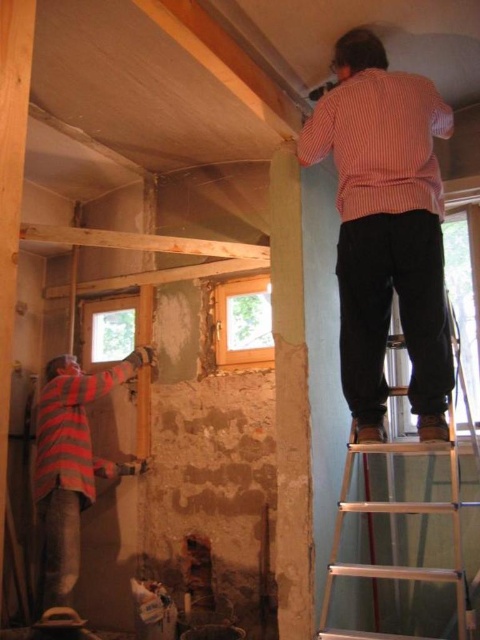
Which is in front, point (431, 177) or point (451, 304)?

Positioned in front is point (431, 177).

Does striped cotton shirt at upper right have a lesser width compared to silver metallic ladder at upper right?

Indeed, striped cotton shirt at upper right has a lesser width compared to silver metallic ladder at upper right.

Does point (361, 417) lie behind point (456, 384)?

Yes, point (361, 417) is behind point (456, 384).

The image size is (480, 640). I want to click on striped cotton shirt at upper right, so click(385, 228).

Does point (40, 536) come behind point (444, 504)?

Yes, point (40, 536) is behind point (444, 504).

Can you confirm if striped fabric construction worker at lower left is positioned to the right of silver metallic ladder at upper right?

Incorrect, striped fabric construction worker at lower left is not on the right side of silver metallic ladder at upper right.

Which is behind, point (73, 396) or point (348, 456)?

The point (73, 396) is behind.

Where is `striped fabric construction worker at lower left`? The image size is (480, 640). striped fabric construction worker at lower left is located at coordinates (70, 472).

Is striped cotton shirt at upper right to the left of striped fabric construction worker at lower left from the viewer's perspective?

In fact, striped cotton shirt at upper right is to the right of striped fabric construction worker at lower left.

Who is more forward, (379, 272) or (78, 474)?

Point (379, 272) is in front.

Measure the distance between point (434,380) and camera.

Point (434,380) is 7.71 feet away from camera.

I want to click on striped cotton shirt at upper right, so click(x=385, y=228).